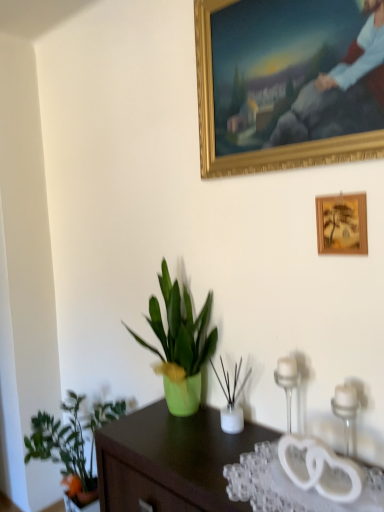
Where is `vacant area that is in front of clear glass candle holder at right, positioned as the first candle holder in back-to-front order`? The height and width of the screenshot is (512, 384). vacant area that is in front of clear glass candle holder at right, positioned as the first candle holder in back-to-front order is located at coordinates coord(293,486).